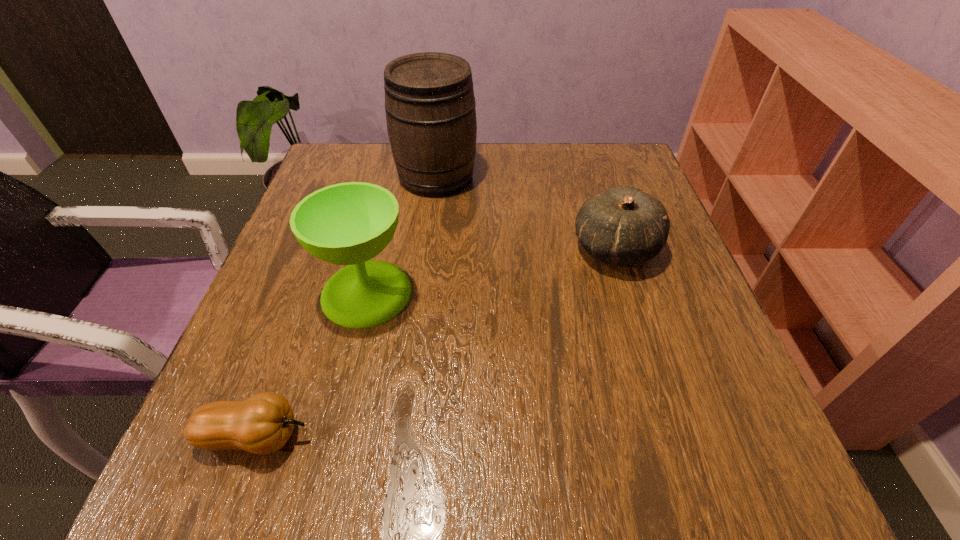
At what (x,y) coordinates should I click in order to perform the action: click on the farthest object. Please return your answer as a coordinate pair (x, y). The width and height of the screenshot is (960, 540). Looking at the image, I should click on (430, 109).

The height and width of the screenshot is (540, 960). I want to click on wine bucket, so click(x=430, y=109).

Locate an element on the screen. the second tallest object is located at coordinates (350, 223).

You are a GUI agent. You are given a task and a screenshot of the screen. Output one action in this format:
    pyautogui.click(x=<x>, y=<y>)
    Task: Click on the farther gourd
    The width and height of the screenshot is (960, 540).
    Given the screenshot: What is the action you would take?
    pyautogui.click(x=624, y=226)

This screenshot has height=540, width=960. I want to click on the rightmost object, so click(x=624, y=226).

Identify the location of the left gourd. (262, 424).

Locate an element on the screen. the nearer gourd is located at coordinates [x=262, y=424].

This screenshot has height=540, width=960. What are the coordinates of `free point located on the left of the wine bucket` in the screenshot? It's located at (340, 177).

Identify the location of blank area located on the right of the second tallest object. point(496,293).

You are a GUI agent. You are given a task and a screenshot of the screen. Output one action in this format:
    pyautogui.click(x=<x>, y=<y>)
    Task: Click on the free space located on the left of the taller gourd
    
    Given the screenshot: What is the action you would take?
    pyautogui.click(x=500, y=248)